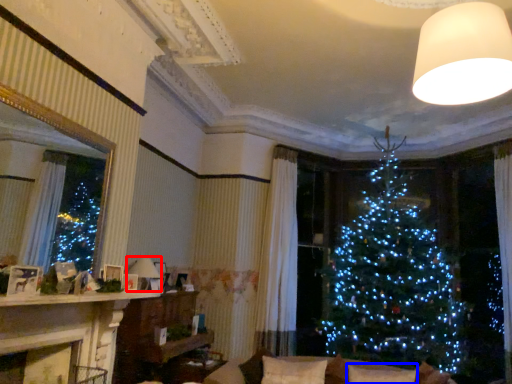
Question: Which object appears closest to the camera in this image, lamp (highlighted by a red box) or pillow (highlighted by a blue box)?

Choices:
 (A) lamp
 (B) pillow

Answer: (B)